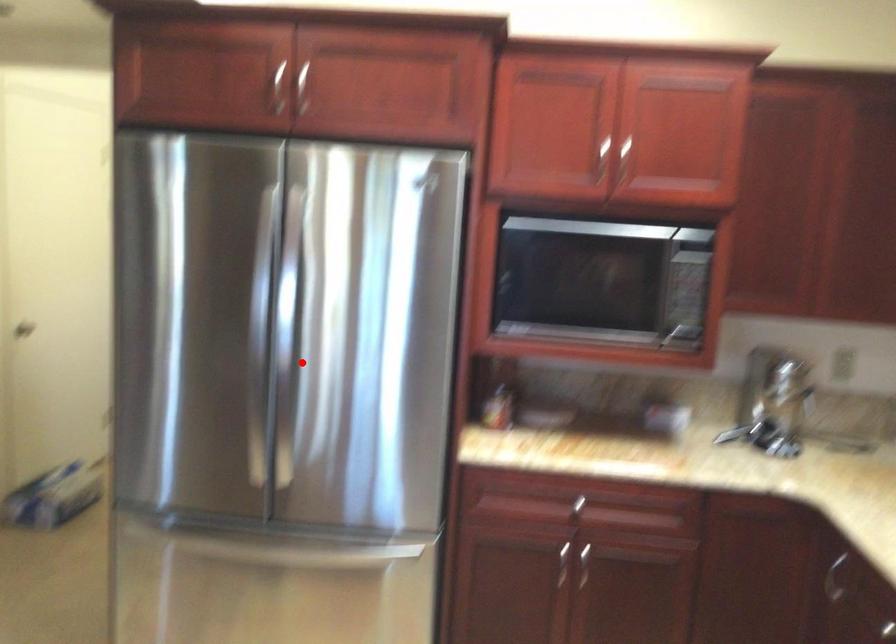
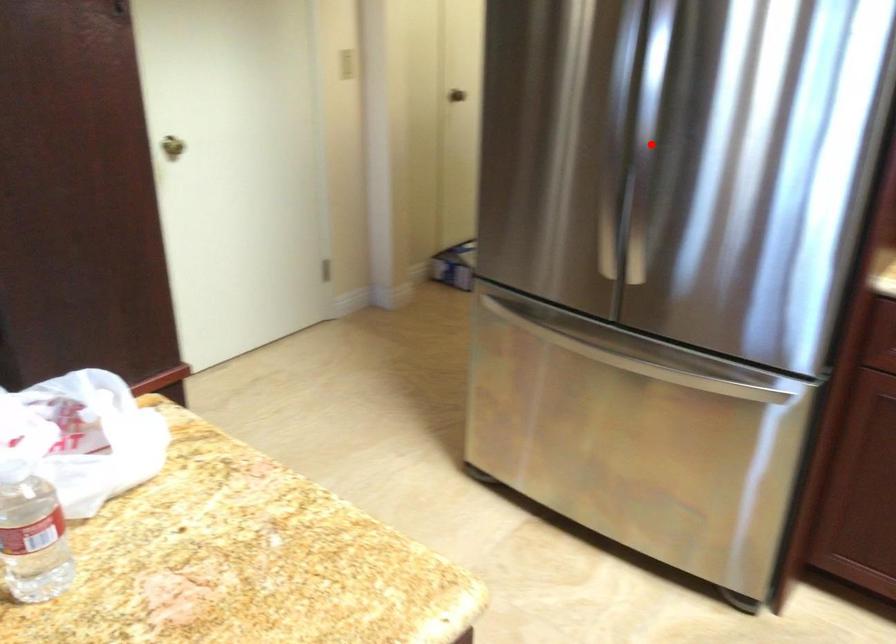
I am providing you with two images of the same scene from different viewpoints. A red point is marked on the first image and another point is marked on the second image. Is the marked point in image1 the same physical position as the marked point in image2?

Yes